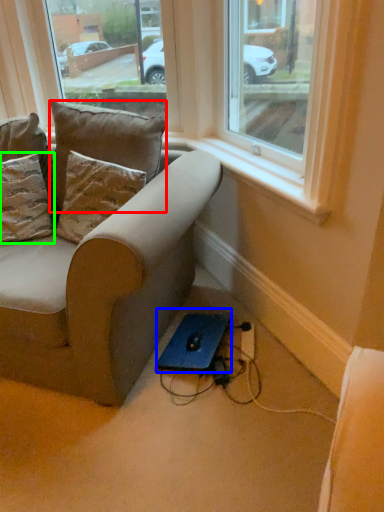
Question: Based on their relative distances, which object is farther from pillow (highlighted by a red box)? Choose from computer (highlighted by a blue box) and pillow (highlighted by a green box).

Choices:
 (A) computer
 (B) pillow

Answer: (A)